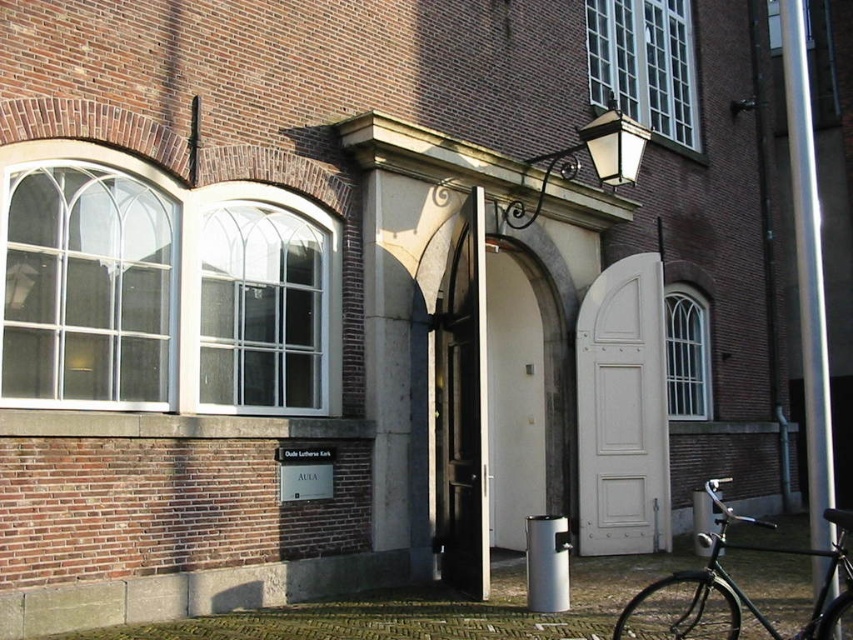
You are standing in front of the brick building and want to enter through the door. There is a shiny black bicycle at lower right blocking your path. Can you walk around the bicycle to reach the white wooden door at center?

The white wooden door at center is to the right of the shiny black bicycle at lower right, so you can walk around the bicycle on the left side to reach the door.

You are standing in front of the brick building and want to enter through the open door. To your left, there is a clear glass window at center and a clear glass window at upper right. Which window is closer to the entrance?

The clear glass window at center is closer to the entrance because it is to the left of the clear glass window at upper right, meaning it is positioned nearer to the entrance on the left side.